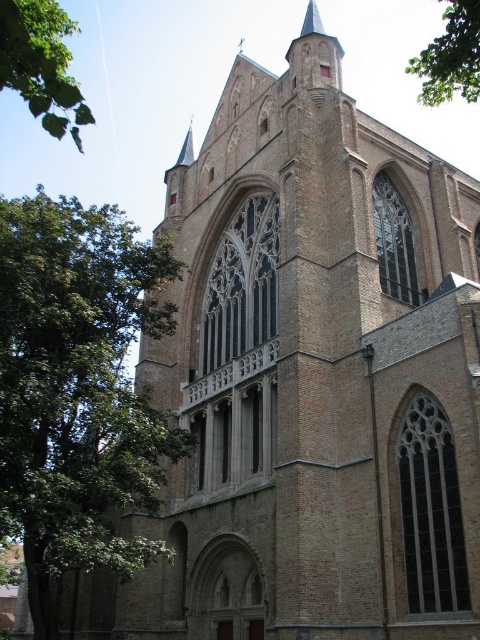
Who is taller, green leafy tree at left or green leafy branch at upper left?

green leafy tree at left is taller.

Is green leafy tree at left shorter than green leafy branch at upper left?

No, green leafy tree at left is not shorter than green leafy branch at upper left.

Does point (35, 260) lie in front of point (54, 32)?

No, (35, 260) is behind (54, 32).

The image size is (480, 640). Identify the location of green leafy tree at left. (76, 388).

Between point (8, 438) and point (469, 96), which one is positioned in front?

Positioned in front is point (8, 438).

Who is positioned more to the left, green leafy tree at left or green leafy tree at upper right?

green leafy tree at left

Which is behind, point (106, 488) or point (410, 74)?

Point (410, 74)

In order to click on green leafy tree at left in this screenshot , I will do `click(76, 388)`.

Who is shorter, green leafy branch at upper left or green leafy tree at upper right?

With less height is green leafy branch at upper left.

Who is taller, green leafy branch at upper left or green leafy tree at upper right?

green leafy tree at upper right is taller.

Is point (8, 20) behind point (468, 42)?

No, (8, 20) is closer to viewer.

The width and height of the screenshot is (480, 640). I want to click on green leafy branch at upper left, so click(41, 65).